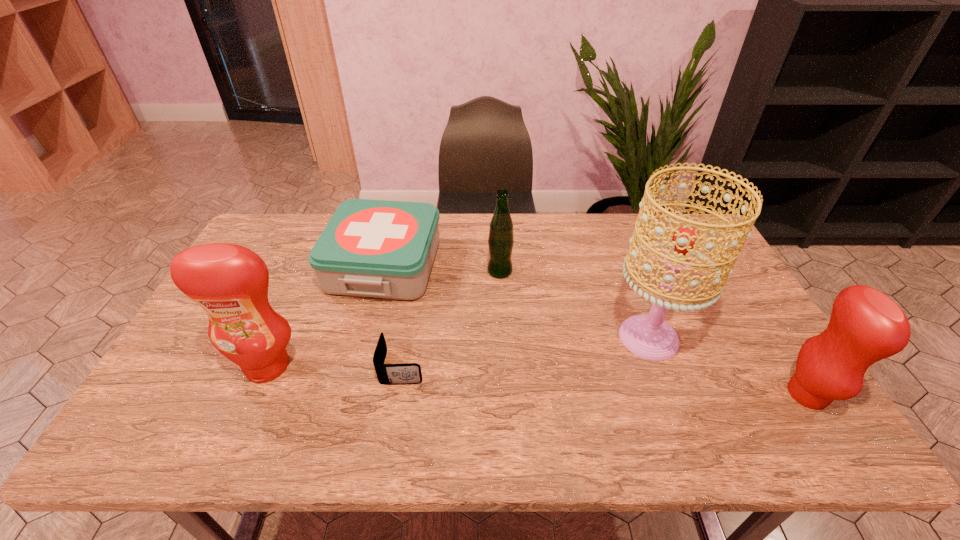
Identify the location of empty space that is in between the rightmost object and the left condiment. (538, 380).

I want to click on free space that is in between the shorter condiment and the tallest object, so click(728, 366).

At what (x,y) coordinates should I click in order to perform the action: click on free space that is in between the beer bottle and the shortest object. Please return your answer as a coordinate pair (x, y). The image size is (960, 540). Looking at the image, I should click on (451, 319).

You are a GUI agent. You are given a task and a screenshot of the screen. Output one action in this format:
    pyautogui.click(x=<x>, y=<y>)
    Task: Click on the vacant space that is in between the lampshade and the beer bottle
    
    Given the screenshot: What is the action you would take?
    pyautogui.click(x=574, y=305)

Select which object appears as the third closest to the fifth shortest object. Please provide its 2D coordinates. Your answer should be formatted as a tuple, i.e. [(x, y)], where the tuple contains the x and y coordinates of a point satisfying the conditions above.

[(501, 239)]

The width and height of the screenshot is (960, 540). Find the location of `the fifth closest object to the left condiment`. the fifth closest object to the left condiment is located at coordinates (866, 326).